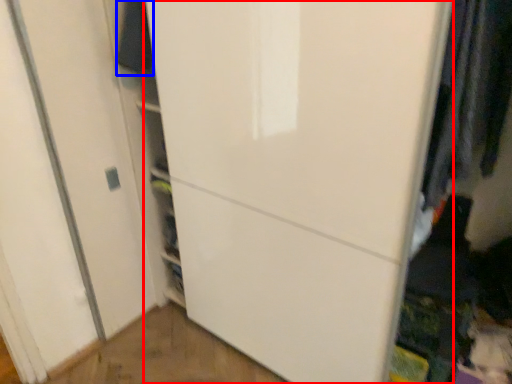
Question: Which point is closer to the camera, door (highlighted by a red box) or clothing (highlighted by a blue box)?

Choices:
 (A) door
 (B) clothing

Answer: (A)